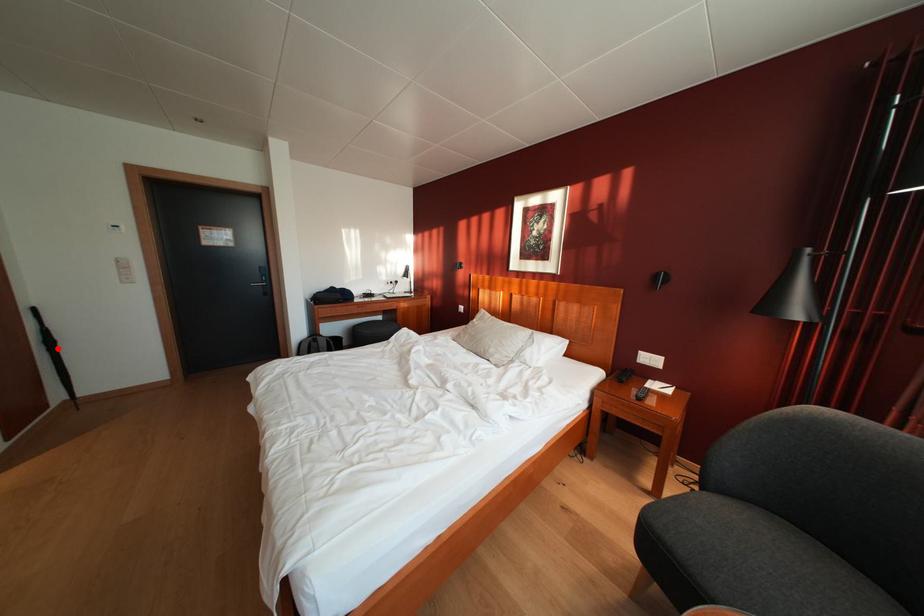
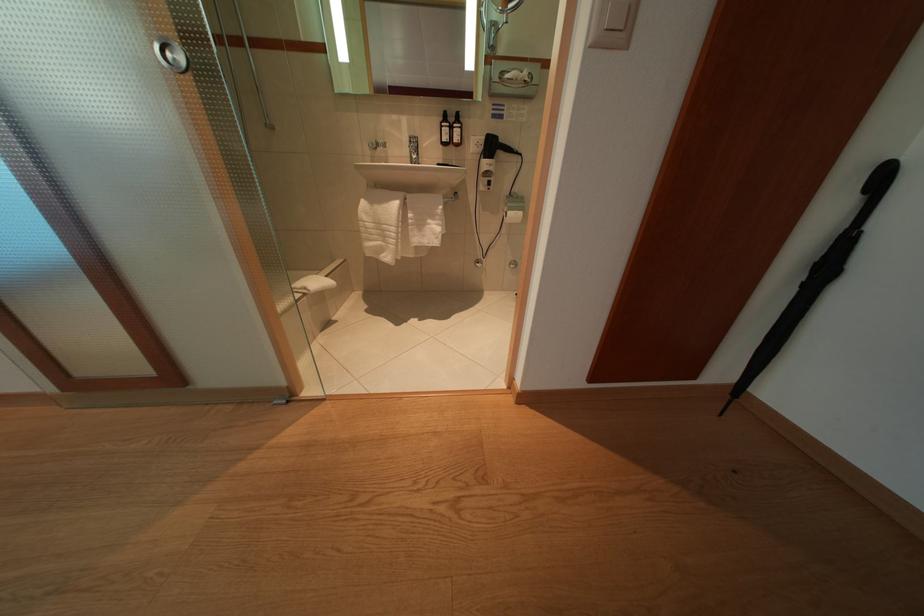
Find the pixel in the second image that matches the highlighted location in the first image.

(834, 275)